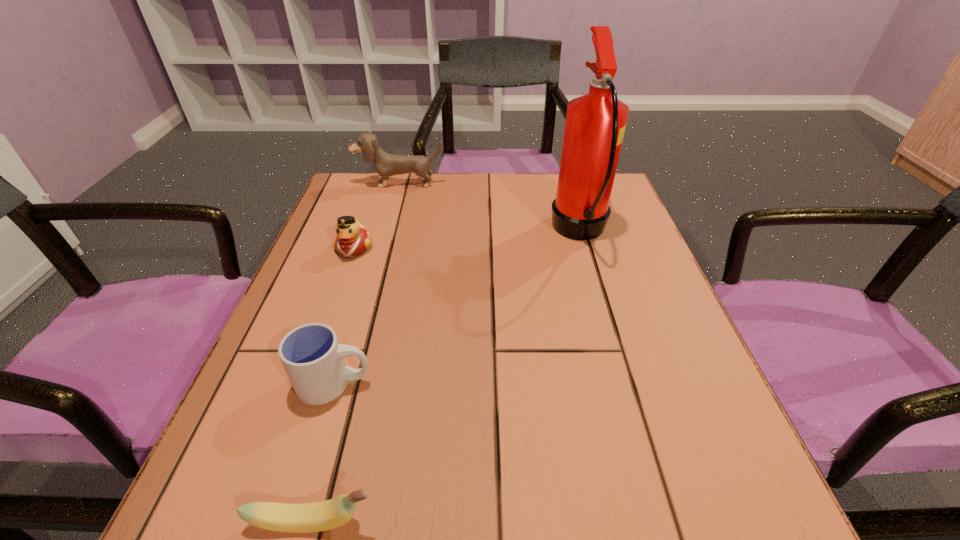
This screenshot has width=960, height=540. I want to click on banana that is at the left edge, so click(x=318, y=516).

Locate an element on the screen. The height and width of the screenshot is (540, 960). object at the right edge is located at coordinates (595, 123).

Locate an element on the screen. The height and width of the screenshot is (540, 960). object at the far left corner is located at coordinates (385, 164).

Image resolution: width=960 pixels, height=540 pixels. Find the location of `object positioned at the near left corner`. object positioned at the near left corner is located at coordinates (318, 516).

Identify the location of object located at the far right corner. This screenshot has width=960, height=540. (595, 123).

At what (x,y) coordinates should I click in order to perform the action: click on blank area at the far edge. Please return your answer as a coordinate pair (x, y). The height and width of the screenshot is (540, 960). Looking at the image, I should click on (490, 207).

Where is `free space at the near edge of the desktop`? Image resolution: width=960 pixels, height=540 pixels. free space at the near edge of the desktop is located at coordinates (382, 495).

The height and width of the screenshot is (540, 960). I want to click on vacant region at the left edge of the desktop, so click(350, 336).

Locate an element on the screen. free spot at the right edge of the desktop is located at coordinates (613, 360).

Find the location of `blank space at the far left corner of the desktop`. blank space at the far left corner of the desktop is located at coordinates (367, 195).